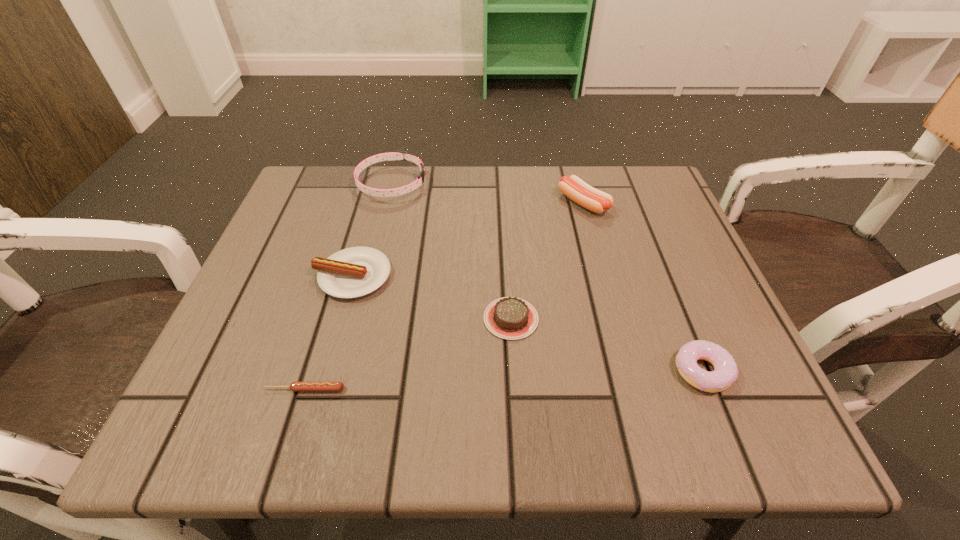
This screenshot has width=960, height=540. Identify the location of sausage located in the right edge section of the desktop. (573, 187).

Locate an element on the screen. The image size is (960, 540). doughnut present at the right edge is located at coordinates (725, 372).

Locate an element on the screen. This screenshot has height=540, width=960. object that is at the far left corner is located at coordinates (397, 154).

Where is `object present at the near left corner`? object present at the near left corner is located at coordinates (294, 386).

This screenshot has width=960, height=540. What are the coordinates of `object that is at the far right corner` in the screenshot? It's located at (573, 187).

Locate an element on the screen. Image resolution: width=960 pixels, height=540 pixels. object that is positioned at the near right corner is located at coordinates (725, 372).

At what (x,y) coordinates should I click in order to perform the action: click on free region at the far edge of the desktop. Please return your answer as a coordinate pair (x, y). Looking at the image, I should click on (445, 199).

At what (x,y) coordinates should I click in order to perform the action: click on vacant area at the near edge. Please return your answer as a coordinate pair (x, y). Looking at the image, I should click on (382, 402).

I want to click on vacant area at the left edge of the desktop, so click(x=258, y=347).

In the image, there is a desktop. Where is `blank space at the right edge`? This screenshot has width=960, height=540. blank space at the right edge is located at coordinates (665, 368).